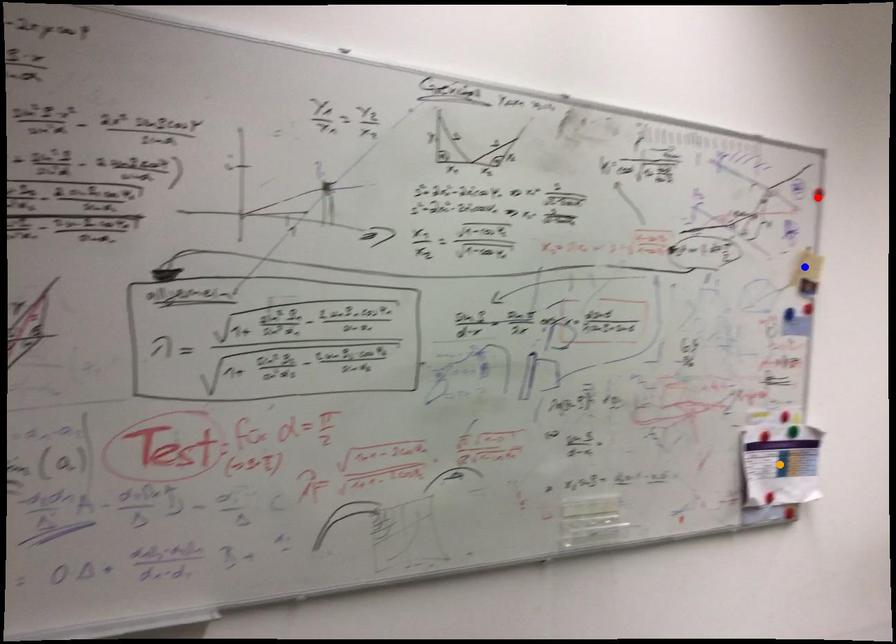
Order these from nearest to farthest:
- orange point
- blue point
- red point

1. orange point
2. red point
3. blue point